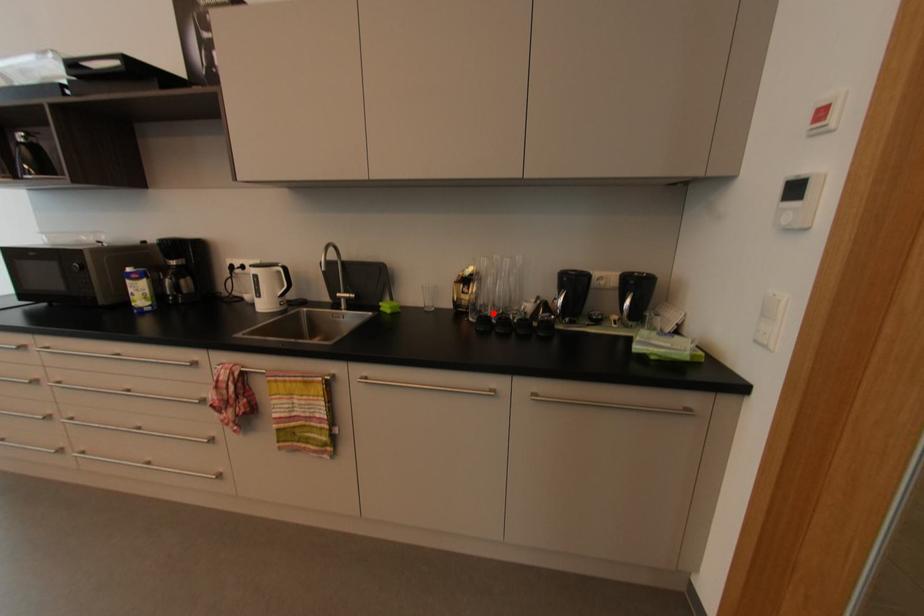
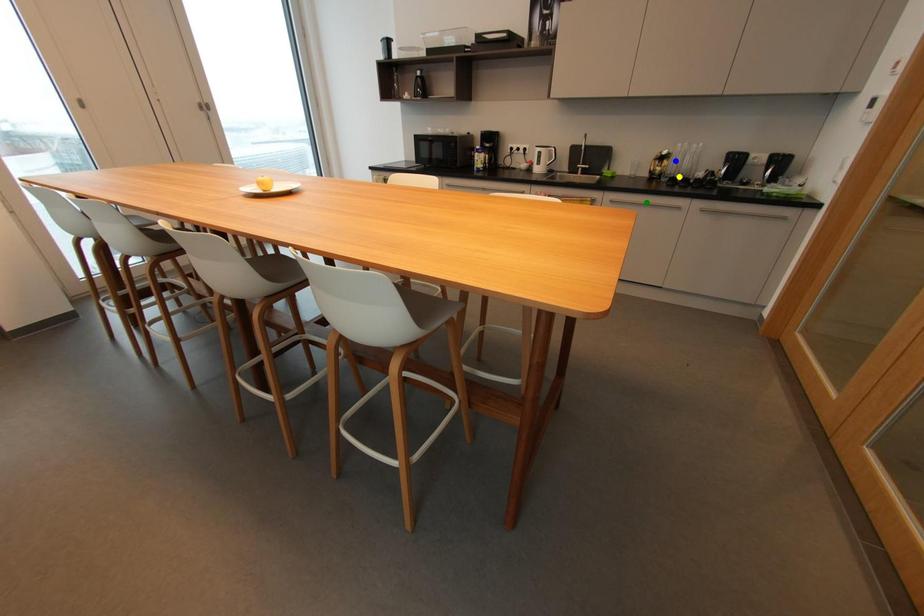
Question: I am providing you with two images of the same scene from different viewpoints. A red point is marked on the first image. You are given multiple points on the second image. In image 2, which mark is for the same physical point as the one in image 1?

Choices:
 (A) green point
 (B) blue point
 (C) yellow point

Answer: (C)